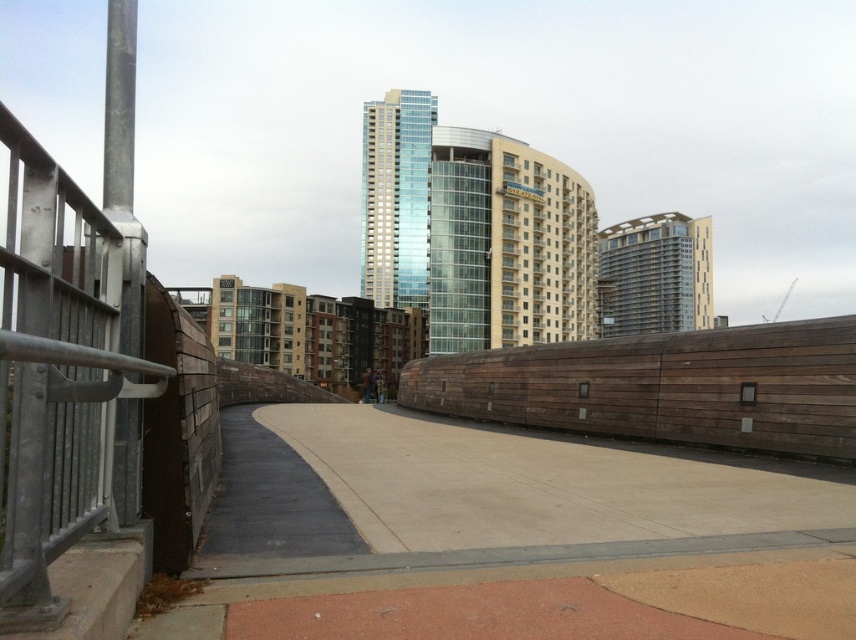
Is point (49, 240) closer to viewer compared to point (441, 401)?

Yes, point (49, 240) is in front of point (441, 401).

Does silver metallic railing at left lie behind brown wooden fence at center?

No, it is not.

I want to click on silver metallic railing at left, so click(57, 378).